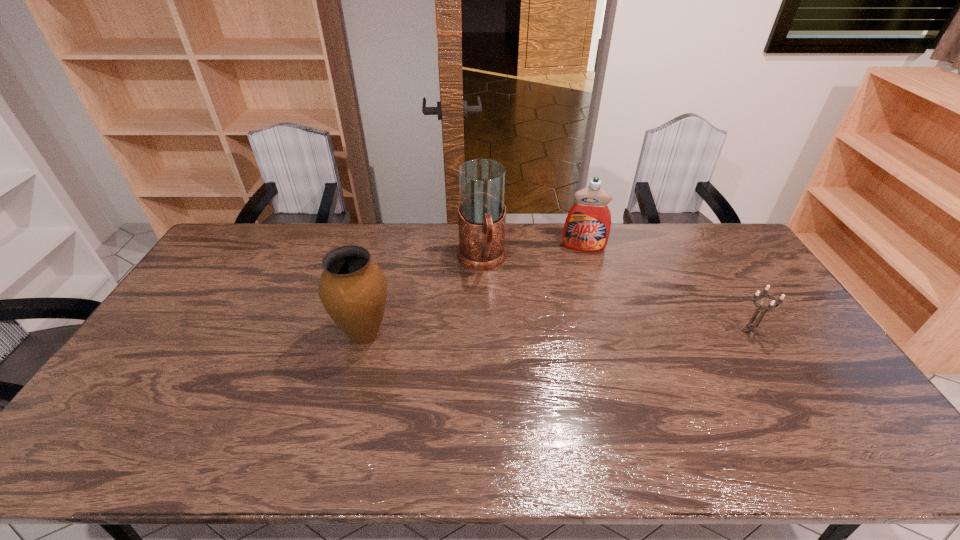
What are the coordinates of `vacant space on the desktop that is between the leftmost object and the rightmost object and is positioned with the handle on the side of the pitcher` in the screenshot? It's located at (501, 333).

Where is `free spot on the desktop that is between the urn and the rightmost object and is positioned on the front surface of the detergent`? free spot on the desktop that is between the urn and the rightmost object and is positioned on the front surface of the detergent is located at coordinates (588, 333).